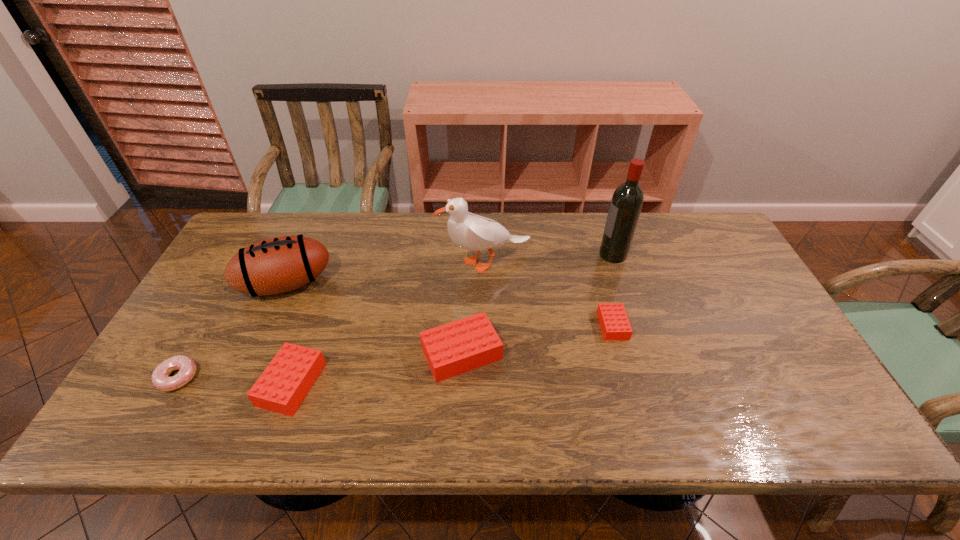
Please point a spot to add another Lego on the right. Please provide its 2D coordinates. Your answer should be formatted as a tuple, i.e. [(x, y)], where the tuple contains the x and y coordinates of a point satisfying the conditions above.

[(748, 301)]